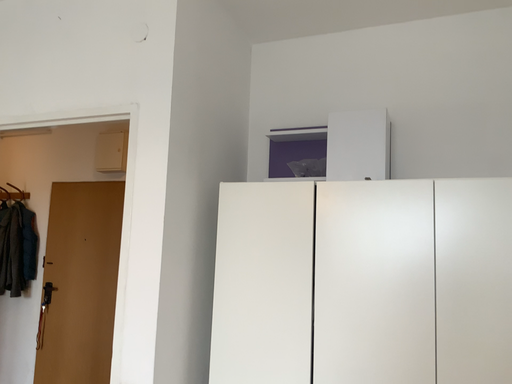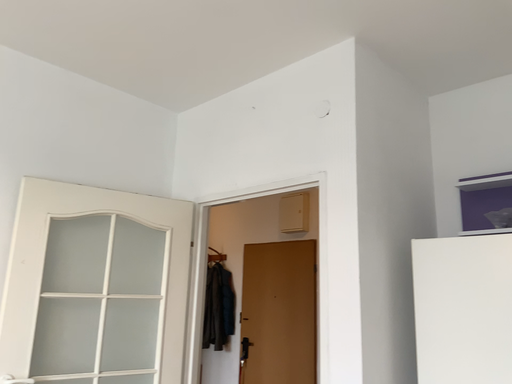
Question: How did the camera likely rotate when shooting the video?

Choices:
 (A) rotated left
 (B) rotated right

Answer: (A)